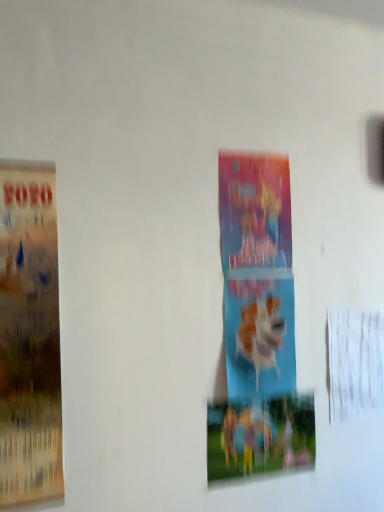
Question: From the image's perspective, would you say colorful paper poster at center, which appears as the second poster when viewed from the front, is shown under matte paper poster at left, which is counted as the first poster, starting from the left?

Choices:
 (A) yes
 (B) no

Answer: (A)

Question: Can you confirm if colorful paper poster at center, the first poster from the right, is bigger than matte paper poster at left, which appears as the 1th poster when viewed from the front?

Choices:
 (A) no
 (B) yes

Answer: (A)

Question: From a real-world perspective, is colorful paper poster at center, the first poster from the right, located higher than matte paper poster at left, which is the second poster from right to left?

Choices:
 (A) no
 (B) yes

Answer: (A)

Question: Is colorful paper poster at center, which is the 1th poster in back-to-front order, positioned far away from matte paper poster at left, which is counted as the first poster, starting from the left?

Choices:
 (A) yes
 (B) no

Answer: (B)

Question: Does colorful paper poster at center, which is the 1th poster in back-to-front order, have a smaller size compared to matte paper poster at left, which is counted as the first poster, starting from the left?

Choices:
 (A) yes
 (B) no

Answer: (A)

Question: Relative to colorful paper poster at center, which appears as the second poster when viewed from the front, is blue matte dog at center in front or behind?

Choices:
 (A) behind
 (B) front

Answer: (A)

Question: From the image's perspective, is blue matte dog at center located above or below colorful paper poster at center, the first poster from the right?

Choices:
 (A) below
 (B) above

Answer: (B)

Question: Does point (274, 310) appear closer or farther from the camera than point (253, 409)?

Choices:
 (A) closer
 (B) farther

Answer: (B)

Question: Considering the relative positions of blue matte dog at center and colorful paper poster at center, the first poster from the right, in the image provided, is blue matte dog at center to the left or to the right of colorful paper poster at center, the first poster from the right,?

Choices:
 (A) left
 (B) right

Answer: (B)

Question: In terms of width, does matte paper poster at left, which is the second poster from right to left, look wider or thinner when compared to colorful paper poster at center, the first poster from the right?

Choices:
 (A) wide
 (B) thin

Answer: (A)

Question: From their relative heights in the image, would you say matte paper poster at left, which is the second poster in back-to-front order, is taller or shorter than colorful paper poster at center, the first poster from the right?

Choices:
 (A) short
 (B) tall

Answer: (B)

Question: Based on their sizes in the image, would you say matte paper poster at left, which is the second poster in back-to-front order, is bigger or smaller than colorful paper poster at center, which is the 1th poster in back-to-front order?

Choices:
 (A) small
 (B) big

Answer: (B)

Question: Considering their positions, is matte paper poster at left, which is the second poster in back-to-front order, located in front of or behind colorful paper poster at center, marked as the 2th poster in a left-to-right arrangement?

Choices:
 (A) front
 (B) behind

Answer: (A)

Question: Would you say colorful paper poster at center, which is the 1th poster in back-to-front order, is inside or outside matte paper poster at left, which is the second poster from right to left?

Choices:
 (A) outside
 (B) inside

Answer: (A)

Question: Based on their positions, is colorful paper poster at center, the first poster from the right, located to the left or right of matte paper poster at left, which is counted as the first poster, starting from the left?

Choices:
 (A) right
 (B) left

Answer: (A)